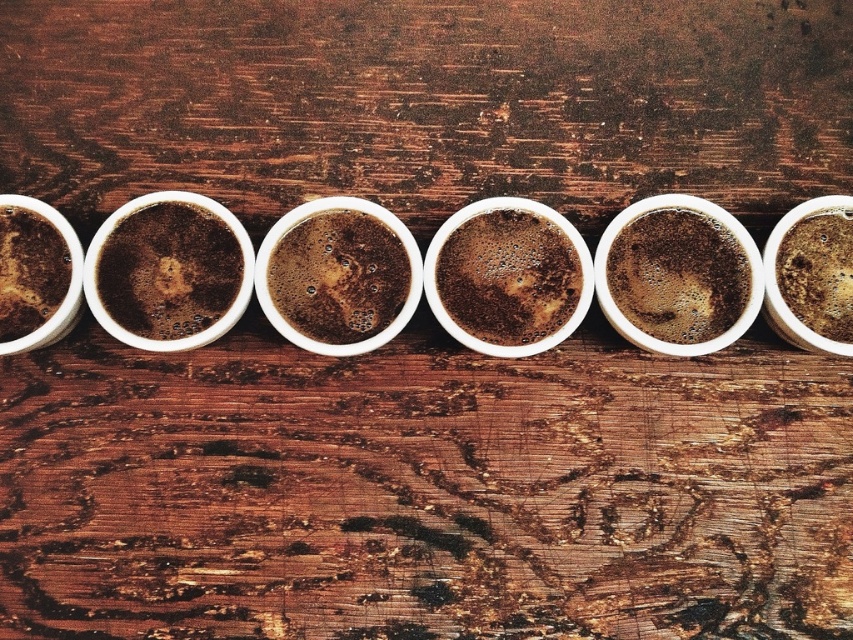
Question: Which point is closer to the camera taking this photo?

Choices:
 (A) (776, 273)
 (B) (383, 250)
 (C) (45, 317)
 (D) (679, 225)

Answer: (C)

Question: Estimate the real-world distances between objects in this image. Which object is farther from the matte brown coffee at left?

Choices:
 (A) brown matte cup at center
 (B) smokey brown foam at center
 (C) brown matte coffee at center
 (D) smokey brown foam at right

Answer: (D)

Question: Is brown matte cup at center positioned at the back of matte brown coffee at left?

Choices:
 (A) yes
 (B) no

Answer: (A)

Question: Which of the following is the closest to the observer?

Choices:
 (A) matte brown coffee at center
 (B) brown matte coffee at center

Answer: (A)

Question: Can you confirm if smokey brown foam at center is smaller than matte brown coffee at left?

Choices:
 (A) no
 (B) yes

Answer: (A)

Question: Considering the relative positions of matte brown coffee at center and brown matte cup at center in the image provided, where is matte brown coffee at center located with respect to brown matte cup at center?

Choices:
 (A) below
 (B) above

Answer: (B)